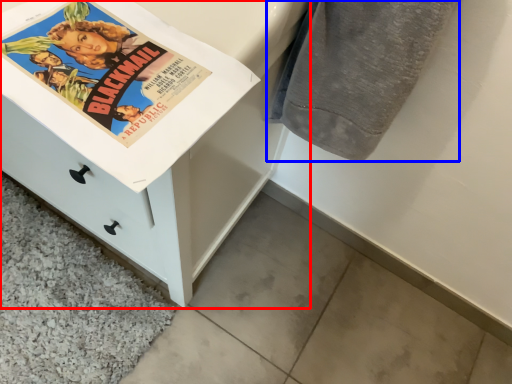
Question: Which point is further to the camera, chest of drawers (highlighted by a red box) or bath towel (highlighted by a blue box)?

Choices:
 (A) chest of drawers
 (B) bath towel

Answer: (B)